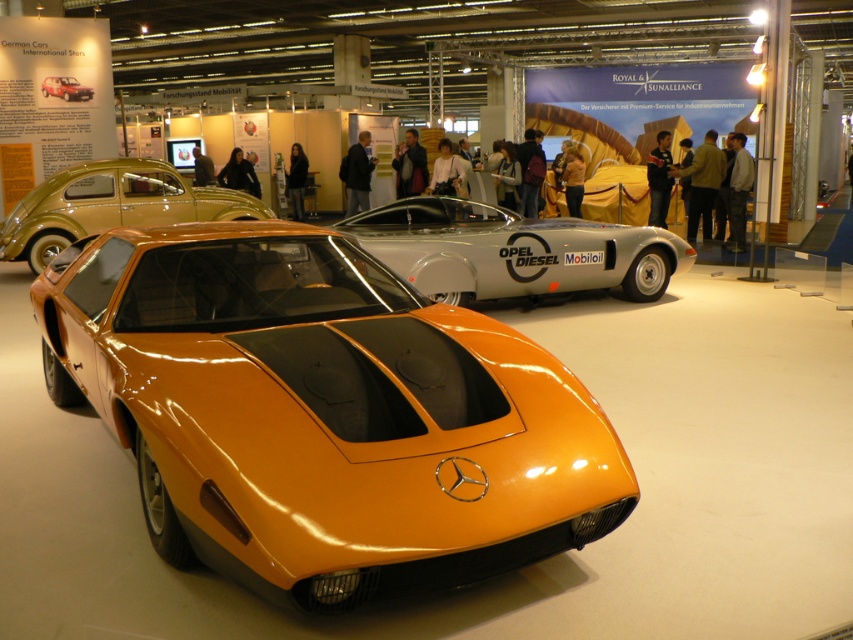
Question: Which point is closer to the camera taking this photo?

Choices:
 (A) (645, 253)
 (B) (67, 88)

Answer: (A)

Question: Is shiny orange car at center above orange glossy car at center?

Choices:
 (A) no
 (B) yes

Answer: (A)

Question: Does silver metallic sports car at center appear over orange glossy car at center?

Choices:
 (A) yes
 (B) no

Answer: (B)

Question: Estimate the real-world distances between objects in this image. Which object is farther from the shiny orange car at center?

Choices:
 (A) silver metallic sports car at center
 (B) matte orange car at center
 (C) orange glossy car at center

Answer: (B)

Question: Is shiny orange car at center positioned at the back of silver metallic sports car at center?

Choices:
 (A) yes
 (B) no

Answer: (B)

Question: Which point is closer to the camera taking this photo?

Choices:
 (A) (524, 284)
 (B) (41, 81)

Answer: (A)